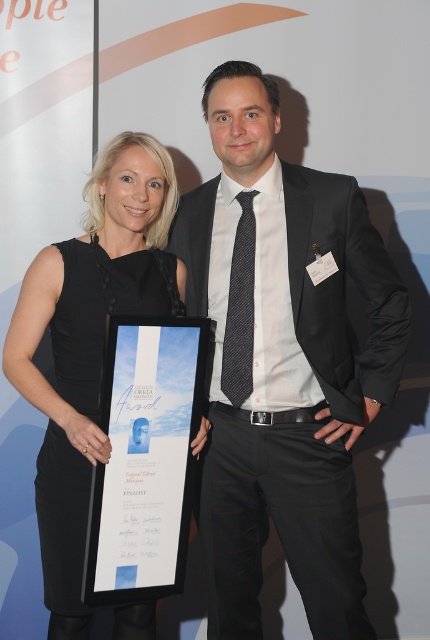
Question: Which point appears closest to the camera in this image?

Choices:
 (A) (319, 232)
 (B) (42, 525)

Answer: (A)

Question: Among these points, which one is farthest from the camera?

Choices:
 (A) (251, 612)
 (B) (135, 632)

Answer: (A)

Question: Which object is farther from the camera taking this photo?

Choices:
 (A) black satin dress at left
 (B) matte black suit at center

Answer: (B)

Question: Does matte black suit at center lie in front of black satin dress at left?

Choices:
 (A) yes
 (B) no

Answer: (B)

Question: Does matte black suit at center have a greater width compared to black satin dress at left?

Choices:
 (A) no
 (B) yes

Answer: (B)

Question: In this image, where is matte black suit at center located relative to black satin dress at left?

Choices:
 (A) right
 (B) left

Answer: (A)